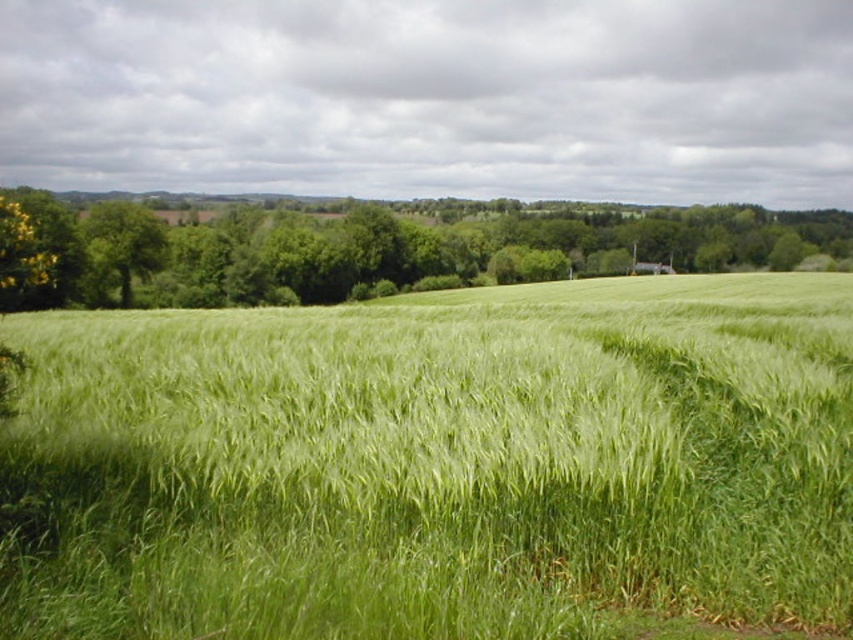
Question: In this image, where is green grassy wheat field at center located relative to green leafy tree at left?

Choices:
 (A) below
 (B) above

Answer: (A)

Question: Considering the real-world distances, which object is farthest from the green grassy wheat field at center?

Choices:
 (A) green leafy tree at left
 (B) green leafy tree at center

Answer: (B)

Question: Can you confirm if green grassy wheat field at center is positioned below green leafy tree at center?

Choices:
 (A) no
 (B) yes

Answer: (B)

Question: Is green grassy wheat field at center smaller than green leafy tree at center?

Choices:
 (A) yes
 (B) no

Answer: (A)

Question: Among these objects, which one is nearest to the camera?

Choices:
 (A) green leafy tree at left
 (B) green grassy wheat field at center

Answer: (B)

Question: Among these points, which one is nearest to the camera?

Choices:
 (A) (283, 212)
 (B) (137, 241)

Answer: (B)